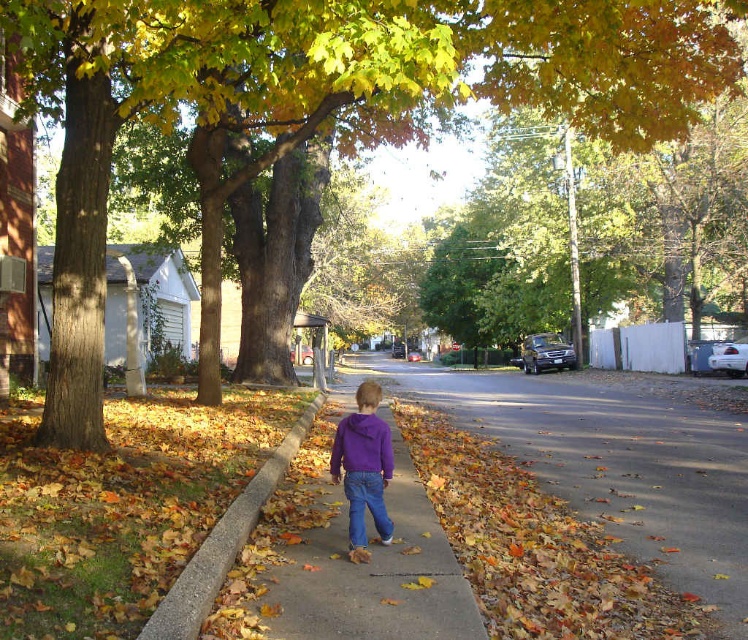
Question: Which point appears closest to the camera in this image?

Choices:
 (A) (349, 477)
 (B) (527, 417)
 (C) (687, 1)

Answer: (A)

Question: Is brown asphalt road at center above purple fleece jacket at center?

Choices:
 (A) yes
 (B) no

Answer: (B)

Question: Which object is positioned farthest from the green leafy tree at center?

Choices:
 (A) purple fabric child at center
 (B) purple fleece jacket at center
 (C) brown asphalt road at center

Answer: (B)

Question: Estimate the real-world distances between objects in this image. Which object is farther from the green leafy tree at center?

Choices:
 (A) brown asphalt road at center
 (B) concrete at lower left
 (C) purple fleece jacket at center

Answer: (B)

Question: Where is brown asphalt road at center located in relation to purple fleece jacket at center in the image?

Choices:
 (A) right
 (B) left

Answer: (A)

Question: Does purple fabric child at center lie behind purple fleece jacket at center?

Choices:
 (A) no
 (B) yes

Answer: (B)